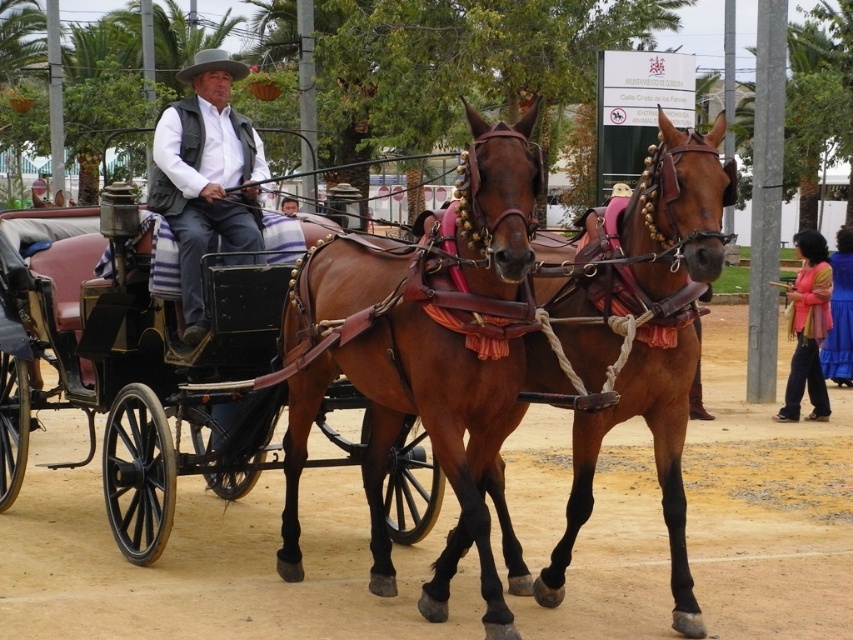
Describe the element at coordinates (808, 326) in the screenshot. I see `pink fabric dress at lower right` at that location.

Is point (817, 349) positioned after point (843, 333)?

No, it is in front of (843, 333).

Locate an element on the screen. This screenshot has width=853, height=640. pink fabric dress at lower right is located at coordinates (808, 326).

Which of these two, brown glossy horse at center or matte black vest at center, stands taller?

Standing taller between the two is brown glossy horse at center.

Is brown glossy horse at center further to the viewer compared to matte black vest at center?

No, it is not.

Between point (587, 332) and point (213, 212), which one is positioned in front?

Point (587, 332) is more forward.

What are the coordinates of `brown glossy horse at center` in the screenshot? It's located at (648, 246).

Does shiny brown leather cart at center have a greater height compared to pink fabric dress at lower right?

Yes, shiny brown leather cart at center is taller than pink fabric dress at lower right.

Between shiny brown leather cart at center and pink fabric dress at lower right, which one has less height?

pink fabric dress at lower right

The image size is (853, 640). Identify the location of shiny brown leather cart at center. (294, 358).